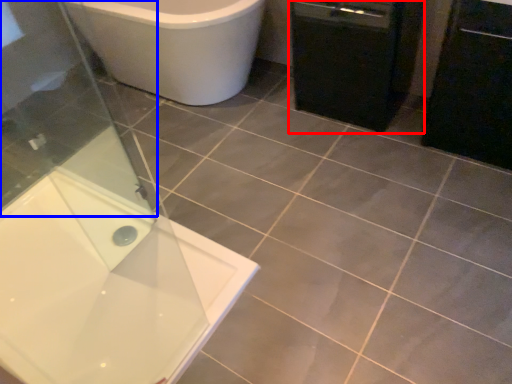
Question: Which object is closer to the camera taking this photo, dish washer (highlighted by a red box) or screen door (highlighted by a blue box)?

Choices:
 (A) dish washer
 (B) screen door

Answer: (B)